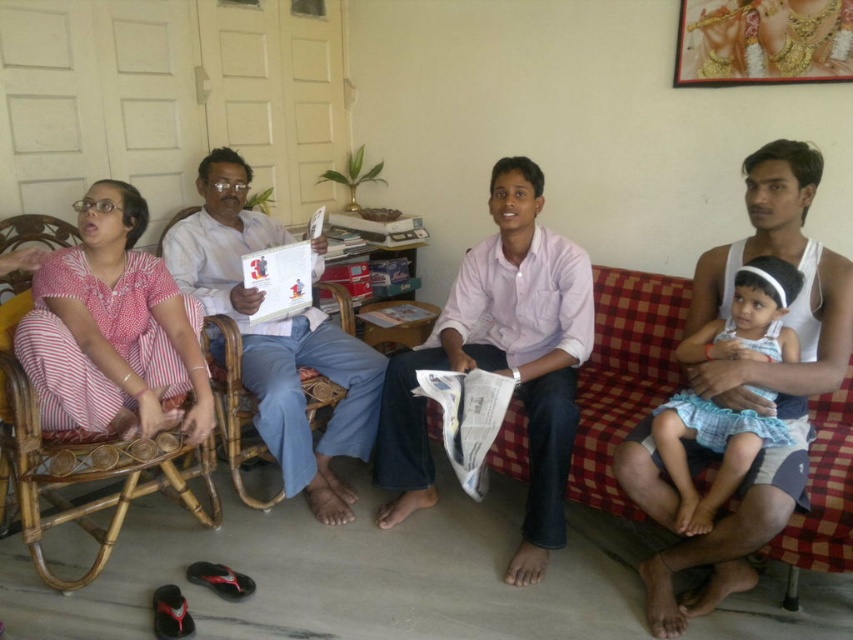
You are organizing a bookshelf and need to place the white paper book at center and the light blue cotton dress at right. Since the bookshelf has limited vertical space, which item should you place first to maximize space efficiency?

The white paper book at center is taller than the light blue cotton dress at right, so you should place the white paper book at center first in the lower shelves to accommodate its height, then stack the lighter item on top.

Where is the white paper book at center located in the image?

The white paper book at center is located at point [276,339].

You are a photographer trying to capture a candid shot of the pink striped dress at left and the white paper book at center. Since you want to ensure both are in focus, which object should you position your camera closer to?

The pink striped dress at left is located above the white paper book at center. To ensure both are in focus, position your camera closer to the white paper book at center so that the dress at left will naturally fall into the frame without blurring.